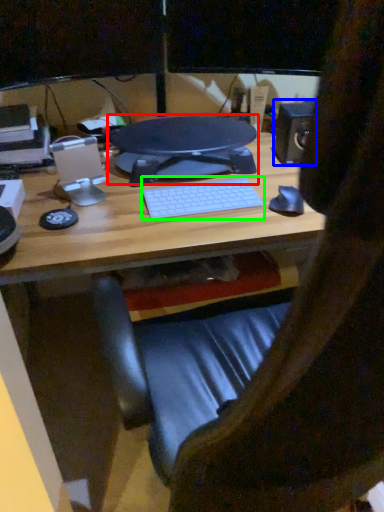
Question: Based on their relative distances, which object is nearer to desktop (highlighted by a red box)? Choose from speaker (highlighted by a blue box) and computer keyboard (highlighted by a green box).

Choices:
 (A) speaker
 (B) computer keyboard

Answer: (B)